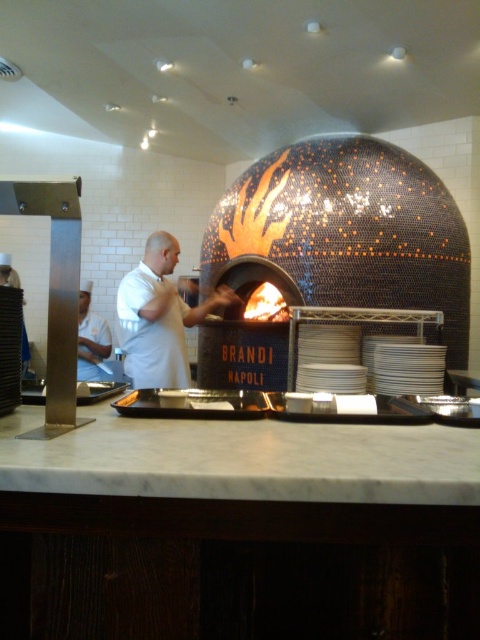
Question: Is white matte uniform at center below white uniform at center?

Choices:
 (A) no
 (B) yes

Answer: (B)

Question: Which is nearer to the brushed metal exhaust hood at left?

Choices:
 (A) white uniform at center
 (B) white matte uniform at center

Answer: (B)

Question: Which is farther from the brushed metal exhaust hood at left?

Choices:
 (A) white uniform at center
 (B) white matte uniform at center

Answer: (A)

Question: Is white matte uniform at center in front of brushed metal exhaust hood at left?

Choices:
 (A) yes
 (B) no

Answer: (B)

Question: Can you confirm if white matte uniform at center is positioned below brushed metal exhaust hood at left?

Choices:
 (A) yes
 (B) no

Answer: (A)

Question: Which object appears farthest from the camera in this image?

Choices:
 (A) white matte uniform at center
 (B) brushed metal exhaust hood at left
 (C) white uniform at center

Answer: (C)